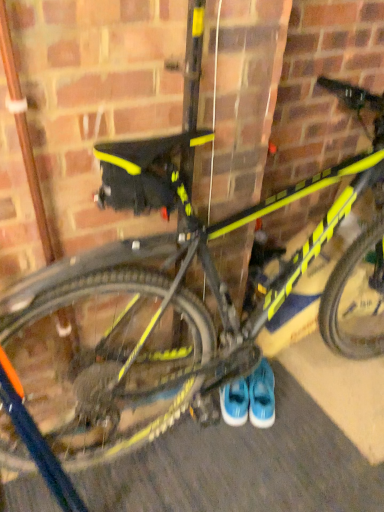
Question: Does blue suede sneakers at center, the 1th footwear positioned from the right, have a lesser width compared to blue suede sneakers at center, which ranks as the 2th footwear in right-to-left order?

Choices:
 (A) yes
 (B) no

Answer: (B)

Question: Is blue suede sneakers at center, which is the first footwear in left-to-right order, located within blue suede sneakers at center, which ranks as the second footwear in left-to-right order?

Choices:
 (A) no
 (B) yes

Answer: (A)

Question: Is blue suede sneakers at center, which ranks as the second footwear in left-to-right order, further to the viewer compared to blue suede sneakers at center, which is the first footwear in left-to-right order?

Choices:
 (A) no
 (B) yes

Answer: (A)

Question: From the image's perspective, is blue suede sneakers at center, the 1th footwear positioned from the right, located above blue suede sneakers at center, which ranks as the 2th footwear in right-to-left order?

Choices:
 (A) no
 (B) yes

Answer: (A)

Question: Can you confirm if blue suede sneakers at center, which ranks as the second footwear in left-to-right order, is positioned to the left of blue suede sneakers at center, which is the first footwear in left-to-right order?

Choices:
 (A) yes
 (B) no

Answer: (B)

Question: Is blue suede sneakers at center, which is the first footwear in left-to-right order, situated inside blue suede sneakers at center, which ranks as the second footwear in left-to-right order, or outside?

Choices:
 (A) inside
 (B) outside

Answer: (B)

Question: Is point (233, 413) closer or farther from the camera than point (271, 411)?

Choices:
 (A) closer
 (B) farther

Answer: (A)

Question: From the image's perspective, is blue suede sneakers at center, which is the first footwear in left-to-right order, positioned above or below blue suede sneakers at center, which ranks as the second footwear in left-to-right order?

Choices:
 (A) below
 (B) above

Answer: (B)

Question: Based on their positions, is blue suede sneakers at center, which ranks as the 2th footwear in right-to-left order, located to the left or right of blue suede sneakers at center, which ranks as the second footwear in left-to-right order?

Choices:
 (A) right
 (B) left

Answer: (B)

Question: Considering the positions of point (273, 396) and point (195, 451), is point (273, 396) closer or farther from the camera than point (195, 451)?

Choices:
 (A) closer
 (B) farther

Answer: (B)

Question: Is blue suede sneakers at center, which ranks as the second footwear in left-to-right order, spatially inside rubberized asphalt at lower center, or outside of it?

Choices:
 (A) inside
 (B) outside

Answer: (B)

Question: Considering the positions of blue suede sneakers at center, the 1th footwear positioned from the right, and rubberized asphalt at lower center in the image, is blue suede sneakers at center, the 1th footwear positioned from the right, taller or shorter than rubberized asphalt at lower center?

Choices:
 (A) short
 (B) tall

Answer: (B)

Question: From the image's perspective, relative to rubberized asphalt at lower center, is blue suede sneakers at center, which ranks as the second footwear in left-to-right order, above or below?

Choices:
 (A) above
 (B) below

Answer: (A)

Question: Does point (228, 407) appear closer or farther from the camera than point (326, 426)?

Choices:
 (A) farther
 (B) closer

Answer: (A)

Question: Based on their positions, is blue suede sneakers at center, which is the first footwear in left-to-right order, located to the left or right of rubberized asphalt at lower center?

Choices:
 (A) left
 (B) right

Answer: (A)